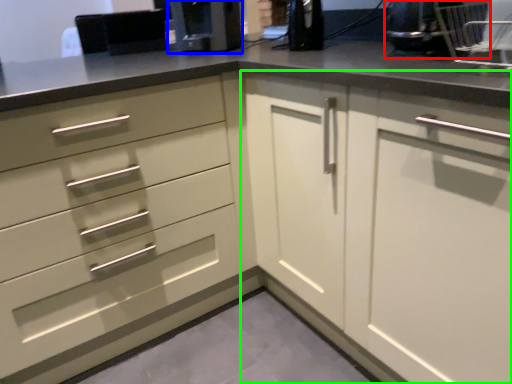
Question: Considering the real-world distances, which object is farthest from appliance (highlighted by a red box)? coffee machine (highlighted by a blue box) or cabinetry (highlighted by a green box)?

Choices:
 (A) coffee machine
 (B) cabinetry

Answer: (A)